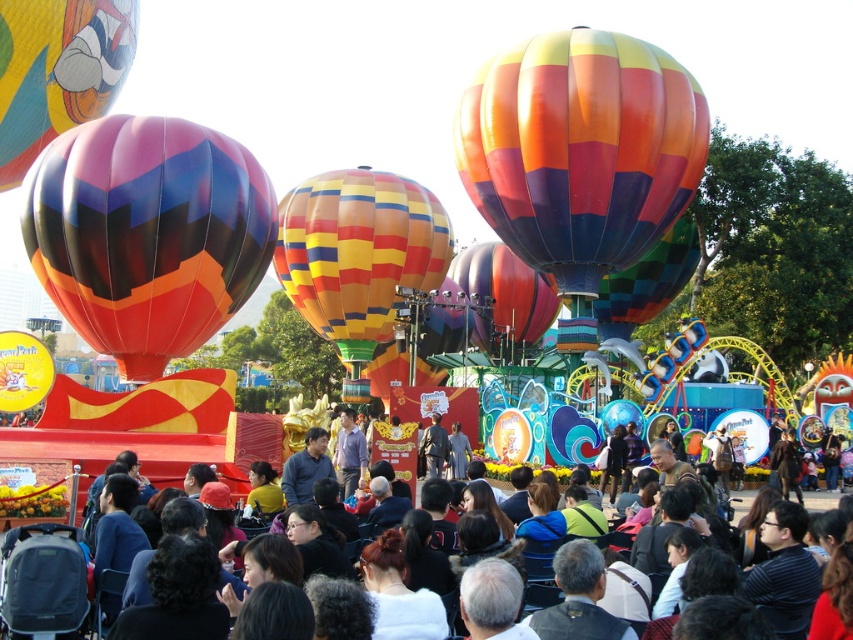
Question: Is matte multicolored balloon at left behind rainbow striped hot air balloon at center?

Choices:
 (A) no
 (B) yes

Answer: (A)

Question: Which of the following is the farthest from the observer?

Choices:
 (A) rainbow striped hot air balloon at center
 (B) multicolored striped hot air balloon at center

Answer: (B)

Question: Does matte multicolored balloon at left come in front of multicolored fabric hot air balloon at center?

Choices:
 (A) yes
 (B) no

Answer: (A)

Question: Which point is closer to the camera?

Choices:
 (A) (752, 497)
 (B) (36, 45)

Answer: (A)

Question: Estimate the real-world distances between objects in this image. Which object is farther from the matte multicolored balloon at left?

Choices:
 (A) multicolored striped hot air balloon at center
 (B) matte black crowd at center
 (C) multicolored fabric hot air balloon at center
 (D) rainbow striped balloon at upper center

Answer: (C)

Question: Does matte multicolored balloon at left appear on the right side of rainbow striped hot air balloon at center?

Choices:
 (A) no
 (B) yes

Answer: (A)